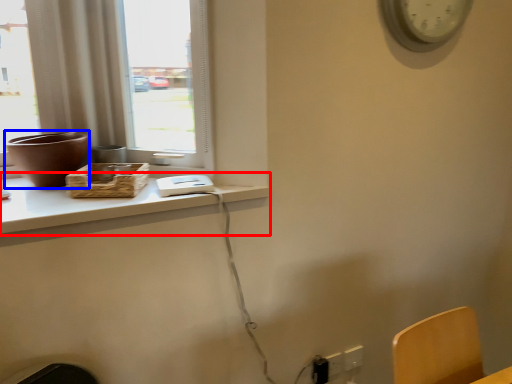
Question: Among these objects, which one is nearest to the camera, computer desk (highlighted by a red box) or vase (highlighted by a blue box)?

Choices:
 (A) computer desk
 (B) vase

Answer: (A)